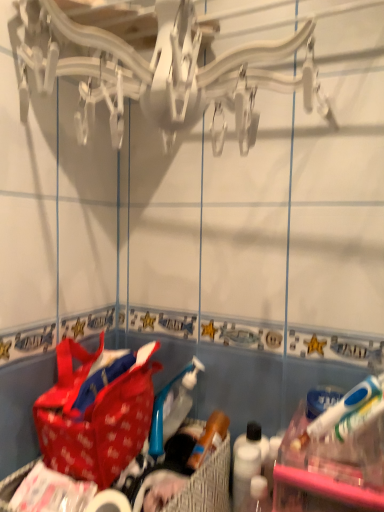
Question: Is red fabric picnic basket at lower center directly adjacent to red fabric handbag at lower left?

Choices:
 (A) yes
 (B) no

Answer: (B)

Question: Can you confirm if red fabric picnic basket at lower center is bigger than red fabric handbag at lower left?

Choices:
 (A) no
 (B) yes

Answer: (B)

Question: From a real-world perspective, is red fabric picnic basket at lower center on top of red fabric handbag at lower left?

Choices:
 (A) no
 (B) yes

Answer: (A)

Question: Are red fabric picnic basket at lower center and red fabric handbag at lower left located far from each other?

Choices:
 (A) no
 (B) yes

Answer: (A)

Question: Can we say red fabric picnic basket at lower center lies outside red fabric handbag at lower left?

Choices:
 (A) yes
 (B) no

Answer: (A)

Question: Considering the positions of red fabric picnic basket at lower center and red fabric handbag at lower left in the image, is red fabric picnic basket at lower center taller or shorter than red fabric handbag at lower left?

Choices:
 (A) short
 (B) tall

Answer: (A)

Question: Looking at the image, does red fabric picnic basket at lower center seem bigger or smaller compared to red fabric handbag at lower left?

Choices:
 (A) small
 (B) big

Answer: (B)

Question: Is red fabric picnic basket at lower center in front of or behind red fabric handbag at lower left in the image?

Choices:
 (A) behind
 (B) front

Answer: (B)

Question: Does point (218, 451) appear closer or farther from the camera than point (104, 467)?

Choices:
 (A) closer
 (B) farther

Answer: (B)

Question: Is white matte toilet paper at lower center inside or outside of red fabric handbag at lower left?

Choices:
 (A) inside
 (B) outside

Answer: (B)

Question: In terms of height, does white matte toilet paper at lower center look taller or shorter compared to red fabric handbag at lower left?

Choices:
 (A) tall
 (B) short

Answer: (B)

Question: Is white matte toilet paper at lower center wider or thinner than red fabric handbag at lower left?

Choices:
 (A) thin
 (B) wide

Answer: (A)

Question: From the image's perspective, relative to red fabric handbag at lower left, is white matte toilet paper at lower center above or below?

Choices:
 (A) above
 (B) below

Answer: (B)

Question: Choose the correct answer: Is red fabric picnic basket at lower center inside white matte toilet paper at lower center or outside it?

Choices:
 (A) outside
 (B) inside

Answer: (A)

Question: In terms of height, does red fabric picnic basket at lower center look taller or shorter compared to white matte toilet paper at lower center?

Choices:
 (A) tall
 (B) short

Answer: (A)